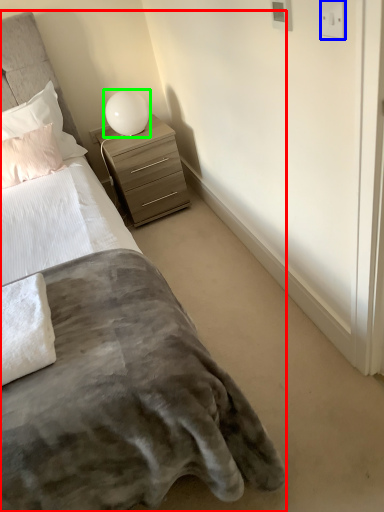
Question: Which object is positioned closest to bed (highlighted by a red box)? Select from electric outlet (highlighted by a blue box) and table lamp (highlighted by a green box).

Choices:
 (A) electric outlet
 (B) table lamp

Answer: (A)